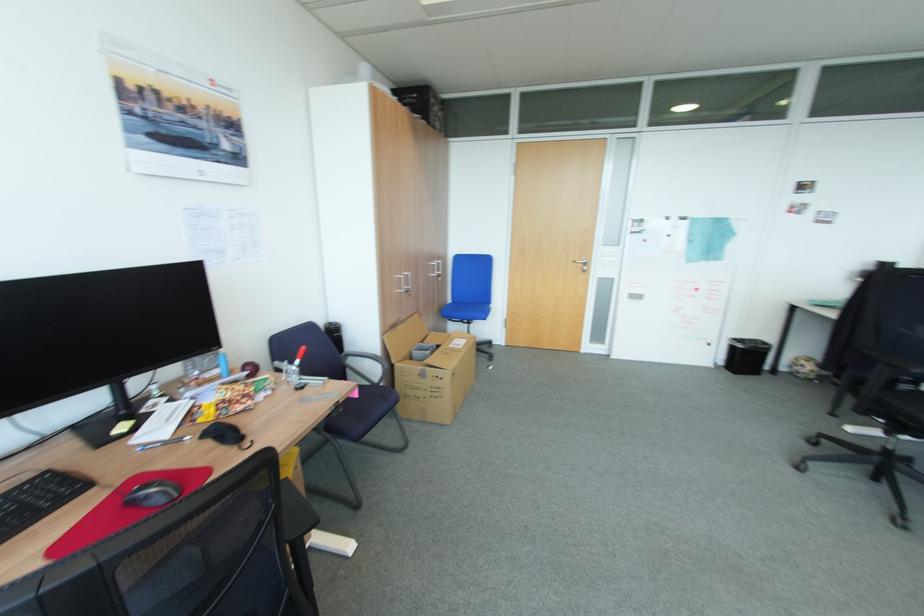
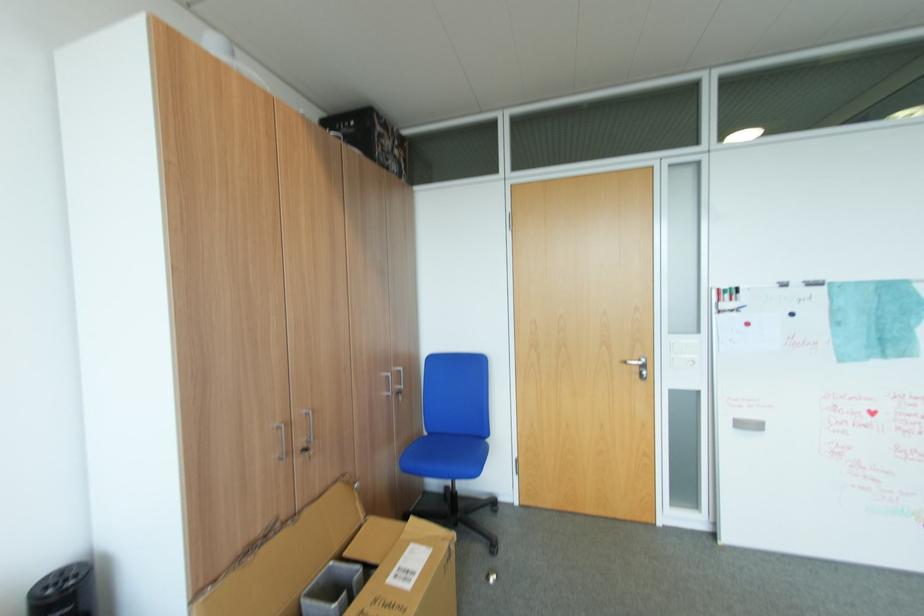
Locate, in the second image, the point that corresponds to [411,292] in the first image.

(310, 451)